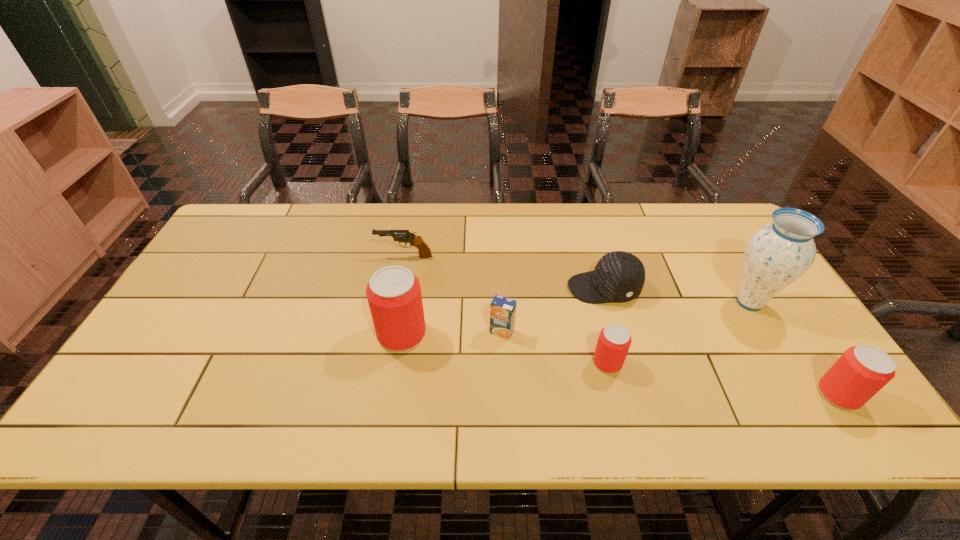
Where is `the tallest beer can`? This screenshot has width=960, height=540. the tallest beer can is located at coordinates pos(394,296).

Find the location of a particular element. The height and width of the screenshot is (540, 960). the sixth shortest object is located at coordinates (394, 296).

In order to click on the shortest beer can in this screenshot , I will do `click(614, 341)`.

The width and height of the screenshot is (960, 540). In order to click on the fifth shortest object in this screenshot , I will do `click(863, 370)`.

This screenshot has width=960, height=540. What are the coordinates of `the second tallest beer can` in the screenshot? It's located at (863, 370).

Image resolution: width=960 pixels, height=540 pixels. In order to click on the farthest object in this screenshot , I will do `click(405, 236)`.

Image resolution: width=960 pixels, height=540 pixels. In order to click on the tallest object in this screenshot , I will do `click(777, 254)`.

Locate an element on the screen. This screenshot has width=960, height=540. baseball cap is located at coordinates (619, 276).

This screenshot has width=960, height=540. I want to click on the fifth object from right to left, so click(502, 310).

The image size is (960, 540). I want to click on blank space located on the back of the second tallest object, so click(408, 294).